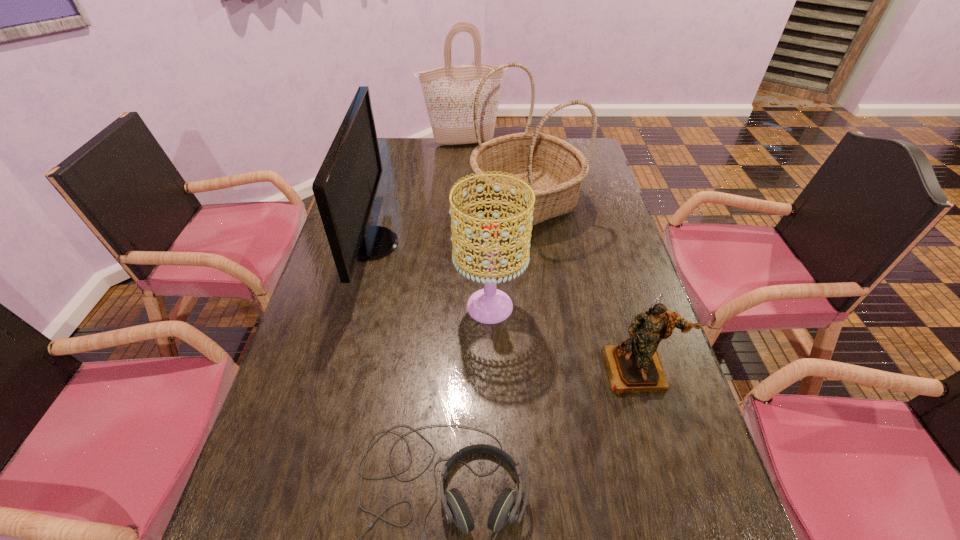
Find the location of a particular element. The image size is (960, 540). the farthest object is located at coordinates (449, 92).

In order to click on basket in this screenshot , I will do `click(555, 169)`.

Where is `computer monitor`? computer monitor is located at coordinates (345, 187).

Identify the location of lampshade. The height and width of the screenshot is (540, 960). (489, 305).

This screenshot has height=540, width=960. I want to click on the second nearest object, so click(634, 366).

Where is `the fifth tallest object`? The height and width of the screenshot is (540, 960). the fifth tallest object is located at coordinates (634, 366).

This screenshot has width=960, height=540. I want to click on vacant space positioned 0.080m on the front of the farthest object, so click(463, 159).

The width and height of the screenshot is (960, 540). Identify the location of free space located 0.160m on the back of the basket. (519, 150).

I want to click on vacant space situated on the front-facing side of the computer monitor, so click(x=483, y=243).

You are a GUI agent. You are given a task and a screenshot of the screen. Output one action in this format:
    pyautogui.click(x=<x>, y=<y>)
    Task: Click on the vacant space located 0.400m on the front of the lampshade
    The height and width of the screenshot is (540, 960).
    Given the screenshot: What is the action you would take?
    pyautogui.click(x=493, y=502)